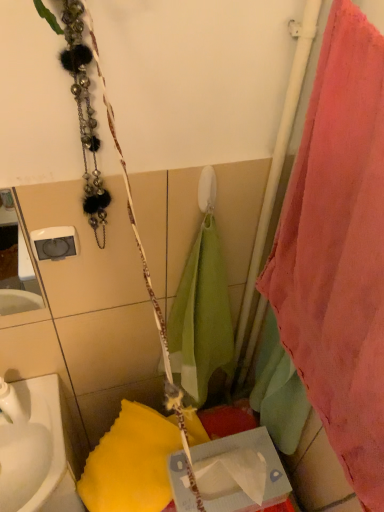
What do you see at coordinates (36, 448) in the screenshot? I see `white glossy sink at lower left` at bounding box center [36, 448].

Describe the element at coordinates (339, 251) in the screenshot. The image size is (384, 512). I see `pink fabric towel at right` at that location.

What are the coordinates of `white glossy sink at lower left` in the screenshot? It's located at (36, 448).

Looking at this image, is pink fabric towel at right positioned with its back to white glossy sink at lower left?

No.

Does pink fabric towel at right have a greater width compared to white glossy sink at lower left?

In fact, pink fabric towel at right might be narrower than white glossy sink at lower left.

You are a GUI agent. You are given a task and a screenshot of the screen. Output one action in this format:
    pyautogui.click(x=<x>, y=<y>)
    Task: Click on the sink that is behind the pink fabric towel at right
    This screenshot has height=512, width=384.
    Given the screenshot: What is the action you would take?
    pyautogui.click(x=36, y=448)

Can you see pink fabric towel at right touching white glossy sink at lower left?

No.

From a real-world perspective, between white glossy sink at lower left and cardboard tissue box at center, who is vertically higher?

cardboard tissue box at center is physically above.

What's the angular difference between white glossy sink at lower left and cardboard tissue box at center's facing directions?

87.1 degrees separate the facing orientations of white glossy sink at lower left and cardboard tissue box at center.

From the image's perspective, relative to cardboard tissue box at center, is white glossy sink at lower left above or below?

white glossy sink at lower left is above cardboard tissue box at center.

Considering the relative positions of white glossy sink at lower left and cardboard tissue box at center in the image provided, is white glossy sink at lower left to the right of cardboard tissue box at center from the viewer's perspective?

Incorrect, white glossy sink at lower left is not on the right side of cardboard tissue box at center.

Is cardboard tissue box at center looking in the opposite direction of pink fabric towel at right?

No, cardboard tissue box at center's orientation is not away from pink fabric towel at right.

How far apart are cardboard tissue box at center and pink fabric towel at right?

A distance of 48.44 centimeters exists between cardboard tissue box at center and pink fabric towel at right.

In terms of size, does cardboard tissue box at center appear bigger or smaller than pink fabric towel at right?

Considering their sizes, cardboard tissue box at center takes up less space than pink fabric towel at right.

Choose the correct answer: Is cardboard tissue box at center inside pink fabric towel at right or outside it?

cardboard tissue box at center lies outside pink fabric towel at right.

How different are the orientations of white glossy sink at lower left and pink fabric towel at right in degrees?

They differ by 88 degrees in their facing directions.

Is pink fabric towel at right at the back of white glossy sink at lower left?

No, white glossy sink at lower left is not facing the opposite direction of pink fabric towel at right.

From the image's perspective, between white glossy sink at lower left and pink fabric towel at right, who is located below?

white glossy sink at lower left.

Is cardboard tissue box at center at the right side of white glossy sink at lower left?

Indeed, cardboard tissue box at center is positioned on the right side of white glossy sink at lower left.

How different are the orientations of cardboard tissue box at center and white glossy sink at lower left in degrees?

The angular difference between cardboard tissue box at center and white glossy sink at lower left is 87.1 degrees.

Is point (210, 498) closer to camera compared to point (70, 478)?

Yes, it is in front of point (70, 478).

From the image's perspective, is cardboard tissue box at center located beneath white glossy sink at lower left?

Indeed, from the image's perspective, cardboard tissue box at center is shown beneath white glossy sink at lower left.

Is pink fabric towel at right bigger or smaller than cardboard tissue box at center?

Clearly, pink fabric towel at right is larger in size than cardboard tissue box at center.

Is the surface of pink fabric towel at right in direct contact with cardboard tissue box at center?

No, pink fabric towel at right is not touching cardboard tissue box at center.

Could cardboard tissue box at center be considered to be inside pink fabric towel at right?

That's incorrect, cardboard tissue box at center is not inside pink fabric towel at right.

The width and height of the screenshot is (384, 512). I want to click on sink that is behind the pink fabric towel at right, so click(36, 448).

In order to click on box located above the white glossy sink at lower left (from a real-world perspective) in this screenshot , I will do `click(240, 472)`.

From the image, which object appears to be farther from white glossy sink at lower left, pink fabric towel at right or cardboard tissue box at center?

Based on the image, pink fabric towel at right appears to be further to white glossy sink at lower left.

From the image, which object appears to be farther from cardboard tissue box at center, white glossy sink at lower left or pink fabric towel at right?

pink fabric towel at right is positioned further to the anchor cardboard tissue box at center.

When comparing their distances from pink fabric towel at right, does white glossy sink at lower left or cardboard tissue box at center seem closer?

Among the two, cardboard tissue box at center is located nearer to pink fabric towel at right.

Based on their spatial positions, is cardboard tissue box at center or white glossy sink at lower left closer to pink fabric towel at right?

cardboard tissue box at center is closer to pink fabric towel at right.

Based on their spatial positions, is cardboard tissue box at center or pink fabric towel at right further from white glossy sink at lower left?

pink fabric towel at right.

Looking at the image, which one is located closer to cardboard tissue box at center, pink fabric towel at right or white glossy sink at lower left?

white glossy sink at lower left is closer to cardboard tissue box at center.

Locate an element on the screen. box positioned between pink fabric towel at right and white glossy sink at lower left from near to far is located at coordinates (240, 472).